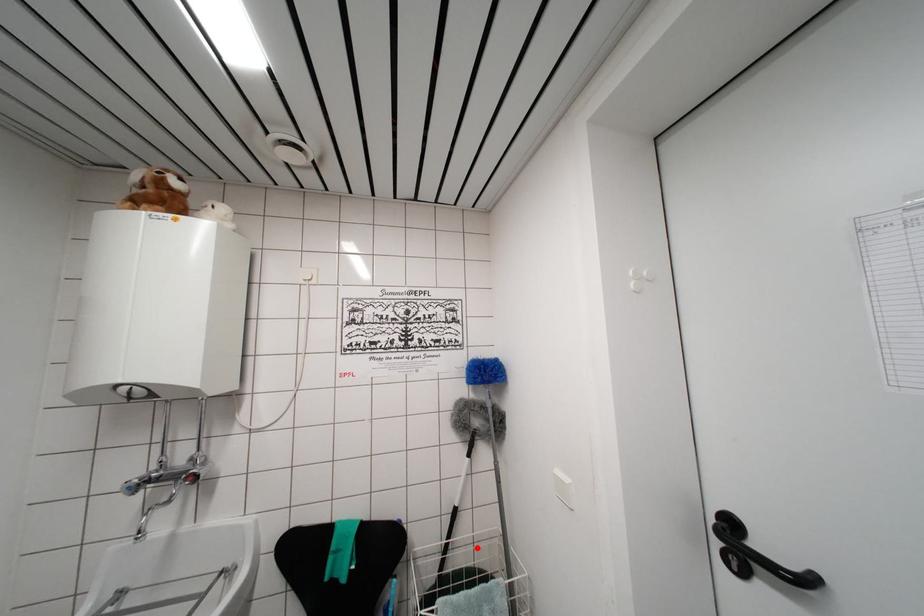
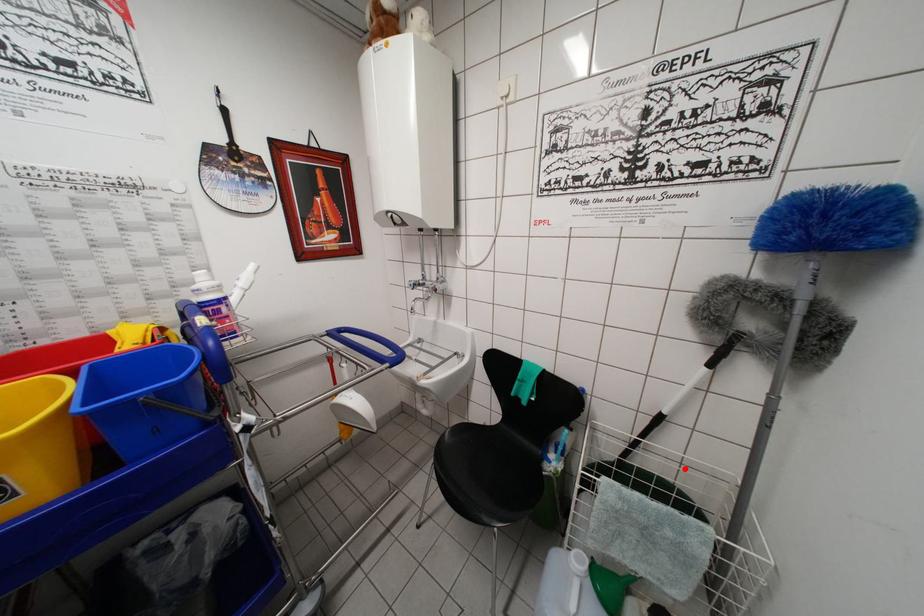
I am providing you with two images of the same scene from different viewpoints. A red point is marked on the first image and another point is marked on the second image. Are the points marked in image1 and image2 representing the same 3D position?

Yes